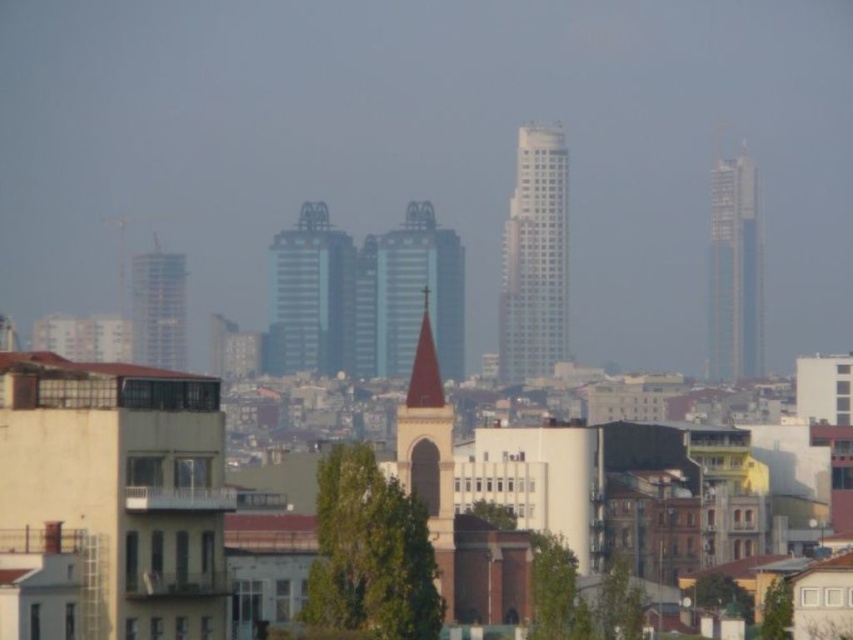
Question: Is brown stone church steeple at center thinner than metallic glass tower at center?

Choices:
 (A) no
 (B) yes

Answer: (B)

Question: Which of these objects is positioned closest to the brown stone church steeple at center?

Choices:
 (A) smooth glass skyscraper at right
 (B) sleek glass skyscraper at center
 (C) white glass tower at center
 (D) light blue glass tower at center

Answer: (D)

Question: Can you confirm if white glass tower at center is positioned to the right of metallic glass tower at center?

Choices:
 (A) yes
 (B) no

Answer: (A)

Question: Is light blue glass tower at center bigger than metallic glass tower at center?

Choices:
 (A) yes
 (B) no

Answer: (B)

Question: Estimate the real-world distances between objects in this image. Which object is farther from the sleek glass skyscraper at center?

Choices:
 (A) smooth glass skyscraper at right
 (B) light blue glass tower at center
 (C) metallic glass tower at center

Answer: (A)

Question: Among these objects, which one is farthest from the camera?

Choices:
 (A) smooth glass skyscraper at right
 (B) metallic glass tower at center
 (C) brown stone church steeple at center

Answer: (A)